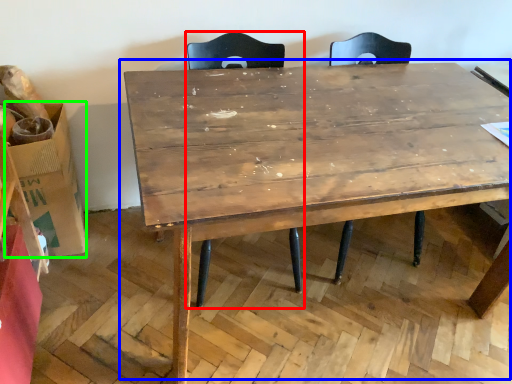
Question: Which object is the farthest from swivel chair (highlighted by a red box)? Choose among these: table (highlighted by a blue box) or cardboard box (highlighted by a green box).

Choices:
 (A) table
 (B) cardboard box

Answer: (B)